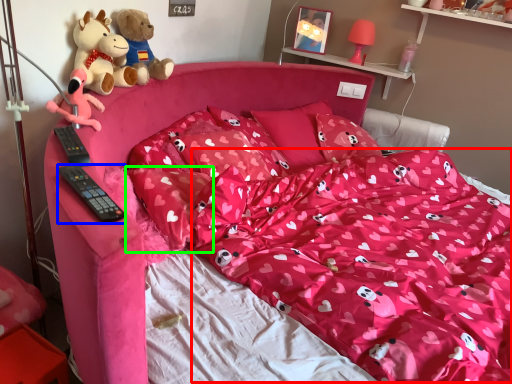
Question: Which is farther away from blanket (highlighted by a red box)? remote control (highlighted by a blue box) or pillow (highlighted by a green box)?

Choices:
 (A) remote control
 (B) pillow

Answer: (A)